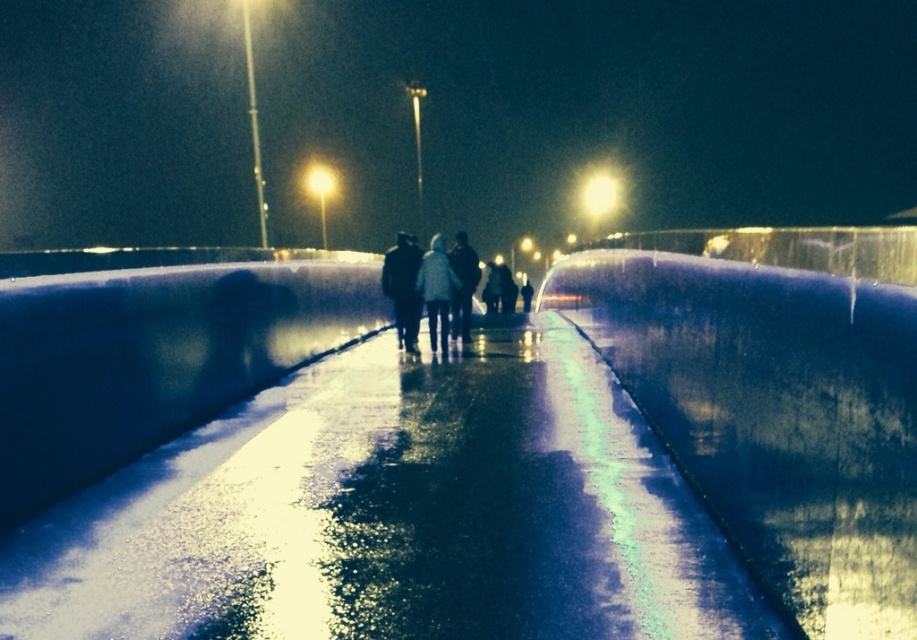
Between silhouette wool coat at center and dark fabric coat at center, which one appears on the right side from the viewer's perspective?

Positioned to the right is silhouette wool coat at center.

Between silhouette wool coat at center and dark fabric coat at center, which one is positioned lower?

silhouette wool coat at center is lower down.

Where is `silhouette wool coat at center`? This screenshot has width=917, height=640. silhouette wool coat at center is located at coordinates (424, 291).

Is smooth concrete wall at center to the left of silhouette wool coat at center from the viewer's perspective?

Incorrect, smooth concrete wall at center is not on the left side of silhouette wool coat at center.

Who is positioned more to the left, smooth concrete wall at center or silhouette wool coat at center?

silhouette wool coat at center

Is point (582, 276) behind point (406, 344)?

Yes, point (582, 276) is behind point (406, 344).

The width and height of the screenshot is (917, 640). I want to click on smooth concrete wall at center, so click(775, 397).

Can you confirm if smooth concrete wall at center is smaller than dark fabric coat at center?

Incorrect, smooth concrete wall at center is not smaller in size than dark fabric coat at center.

Is the position of smooth concrete wall at center less distant than that of dark fabric coat at center?

Yes, it is.

Locate an element on the screen. smooth concrete wall at center is located at coordinates (775, 397).